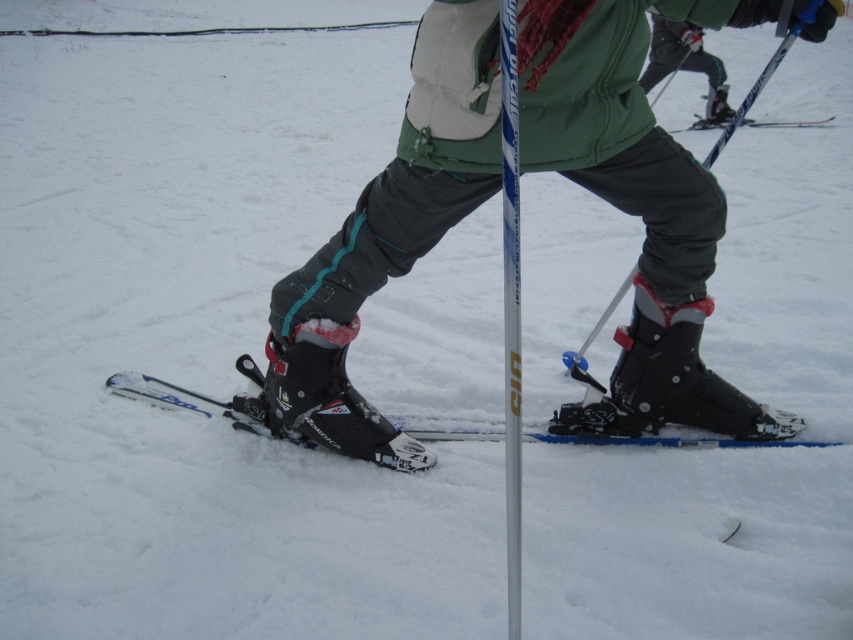
You are a GUI agent. You are given a task and a screenshot of the screen. Output one action in this format:
    pyautogui.click(x=<x>, y=<y>)
    Task: Click on the black matte ski boot at lower right
    The height and width of the screenshot is (640, 853).
    Given the screenshot: What is the action you would take?
    pyautogui.click(x=672, y=372)

How much distance is there between black matte ski boot at lower right and black matte ski boot at lower center?

black matte ski boot at lower right and black matte ski boot at lower center are 30.81 inches apart from each other.

Image resolution: width=853 pixels, height=640 pixels. What do you see at coordinates (672, 372) in the screenshot?
I see `black matte ski boot at lower right` at bounding box center [672, 372].

The width and height of the screenshot is (853, 640). I want to click on black matte ski boot at lower right, so click(x=672, y=372).

Between point (628, 33) and point (653, 337), which one is positioned behind?

The point (653, 337) is more distant.

Image resolution: width=853 pixels, height=640 pixels. What do you see at coordinates (637, 195) in the screenshot?
I see `matte black ski boot at center` at bounding box center [637, 195].

Locate an element on the screen. matte black ski boot at center is located at coordinates (637, 195).

The height and width of the screenshot is (640, 853). Find the location of `matte black ski boot at center`. matte black ski boot at center is located at coordinates (637, 195).

Who is positioned more to the left, black matte ski boot at lower center or blue metallic ski pole at center?

black matte ski boot at lower center is more to the left.

Between point (373, 458) and point (752, 92), which one is positioned in front?

Point (373, 458) is more forward.

The width and height of the screenshot is (853, 640). In order to click on black matte ski boot at lower center in this screenshot , I will do `click(325, 394)`.